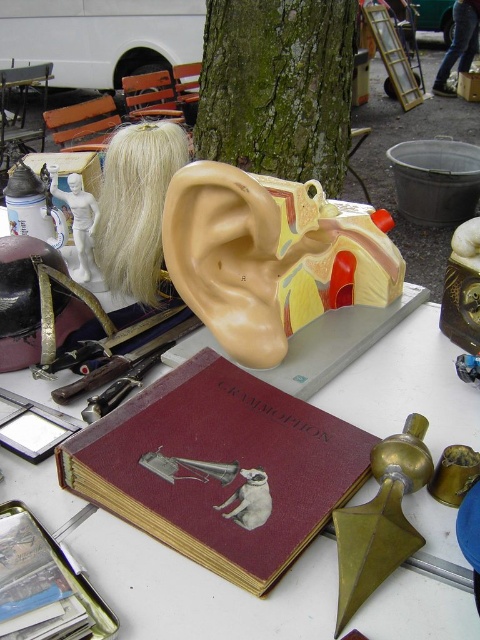
Question: Which of the following is the closest to the observer?

Choices:
 (A) maroon leather book at center
 (B) green rough bark tree at center

Answer: (A)

Question: Does maroon leather book at center appear under green rough bark tree at center?

Choices:
 (A) yes
 (B) no

Answer: (A)

Question: Which point is farther to the camera?

Choices:
 (A) (308, 454)
 (B) (287, 284)
 (C) (218, 116)

Answer: (C)

Question: Does beige rubber ear at center have a smaller size compared to green rough bark tree at center?

Choices:
 (A) yes
 (B) no

Answer: (A)

Question: Is maroon leather book at center positioned at the back of green rough bark tree at center?

Choices:
 (A) yes
 (B) no

Answer: (B)

Question: Which point is closer to the camera taking this photo?

Choices:
 (A) (268, 561)
 (B) (254, 99)
 (C) (294, 241)

Answer: (A)